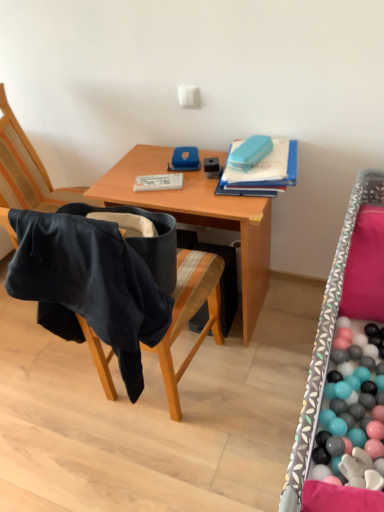
Question: Should I look upward or downward to see blue matte folder at upper right?

Choices:
 (A) up
 (B) down

Answer: (A)

Question: Is wooden desk at center not inside patterned fabric bed frame at right?

Choices:
 (A) no
 (B) yes

Answer: (B)

Question: Considering the relative sizes of wooden desk at center and patterned fabric bed frame at right in the image provided, is wooden desk at center shorter than patterned fabric bed frame at right?

Choices:
 (A) yes
 (B) no

Answer: (A)

Question: Is wooden desk at center further to the viewer compared to patterned fabric bed frame at right?

Choices:
 (A) yes
 (B) no

Answer: (A)

Question: Can you confirm if wooden desk at center is thinner than patterned fabric bed frame at right?

Choices:
 (A) yes
 (B) no

Answer: (B)

Question: Are wooden desk at center and patterned fabric bed frame at right beside each other?

Choices:
 (A) yes
 (B) no

Answer: (B)

Question: From a real-world perspective, is wooden desk at center on patterned fabric bed frame at right?

Choices:
 (A) no
 (B) yes

Answer: (A)

Question: Considering the relative positions of patterned fabric bed frame at right and black fabric chair at left in the image provided, is patterned fabric bed frame at right to the right of black fabric chair at left from the viewer's perspective?

Choices:
 (A) yes
 (B) no

Answer: (A)

Question: Could black fabric chair at left be considered to be inside patterned fabric bed frame at right?

Choices:
 (A) yes
 (B) no

Answer: (B)

Question: Is patterned fabric bed frame at right at the left side of black fabric chair at left?

Choices:
 (A) yes
 (B) no

Answer: (B)

Question: Are patterned fabric bed frame at right and black fabric chair at left making contact?

Choices:
 (A) yes
 (B) no

Answer: (B)

Question: Considering the relative sizes of patterned fabric bed frame at right and black fabric chair at left in the image provided, is patterned fabric bed frame at right wider than black fabric chair at left?

Choices:
 (A) yes
 (B) no

Answer: (B)

Question: Is black fabric chair at left at the back of patterned fabric bed frame at right?

Choices:
 (A) yes
 (B) no

Answer: (A)

Question: Does blue matte folder at upper right contain black fabric chair at left?

Choices:
 (A) no
 (B) yes

Answer: (A)